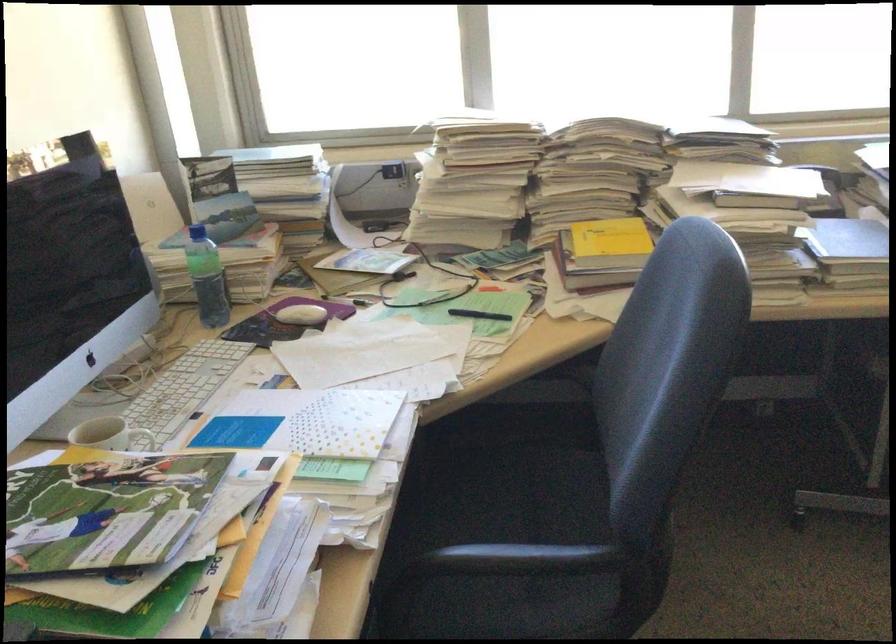
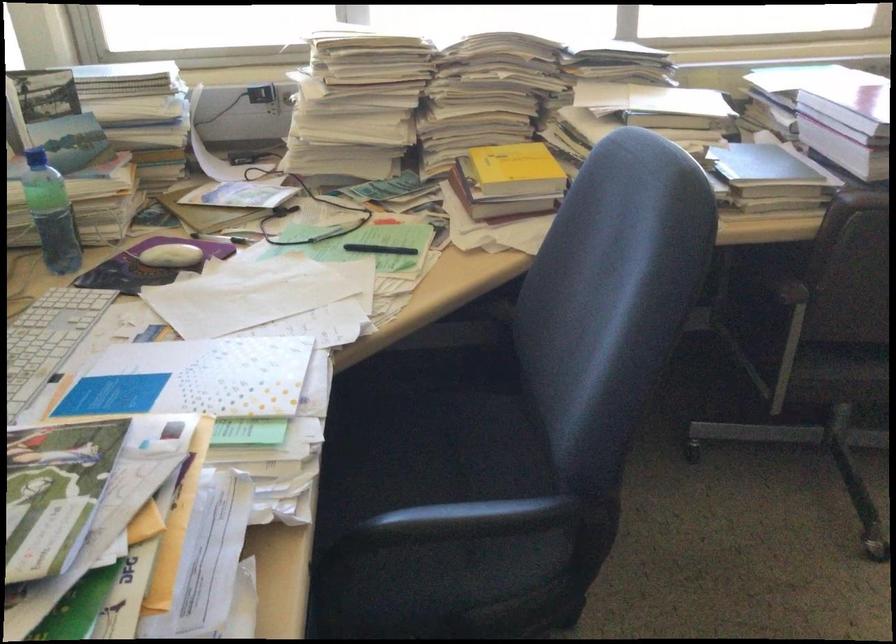
Question: The camera is either moving clockwise (left) or counter-clockwise (right) around the object. The first image is from the beginning of the video and the second image is from the end. Is the camera moving left or right when shooting the video?

Choices:
 (A) Left
 (B) Right

Answer: (A)